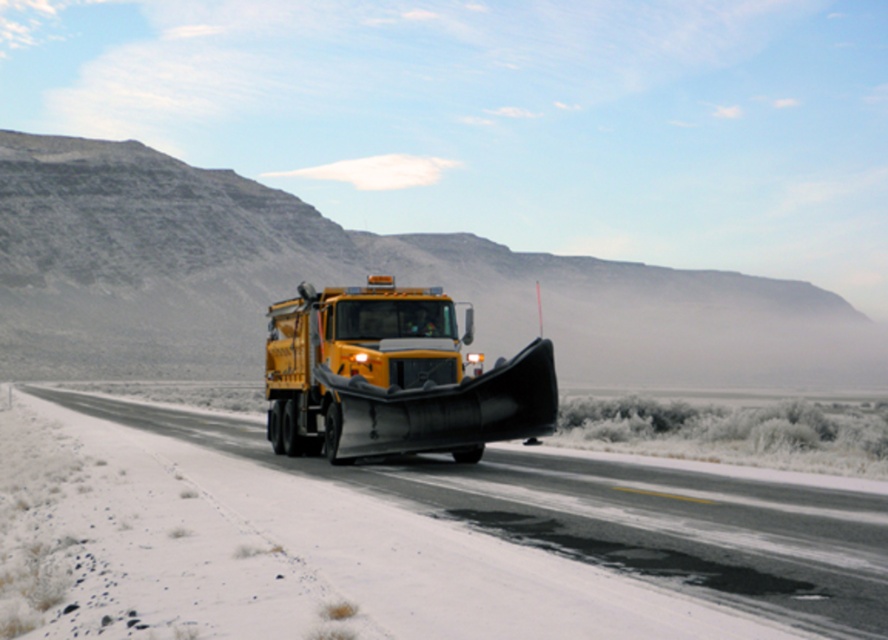
Does black asphalt highway at center appear on the right side of yellow matte/solid truck at center?

In fact, black asphalt highway at center is to the left of yellow matte/solid truck at center.

Is black asphalt highway at center below yellow matte/solid truck at center?

Correct, black asphalt highway at center is located below yellow matte/solid truck at center.

The image size is (888, 640). Describe the element at coordinates (413, 538) in the screenshot. I see `black asphalt highway at center` at that location.

The image size is (888, 640). In order to click on black asphalt highway at center in this screenshot , I will do `click(413, 538)`.